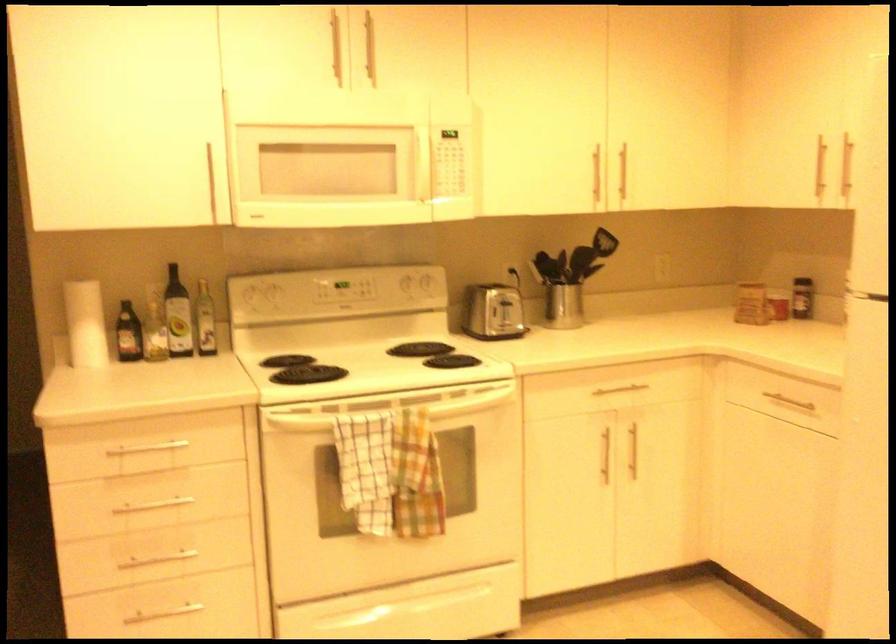
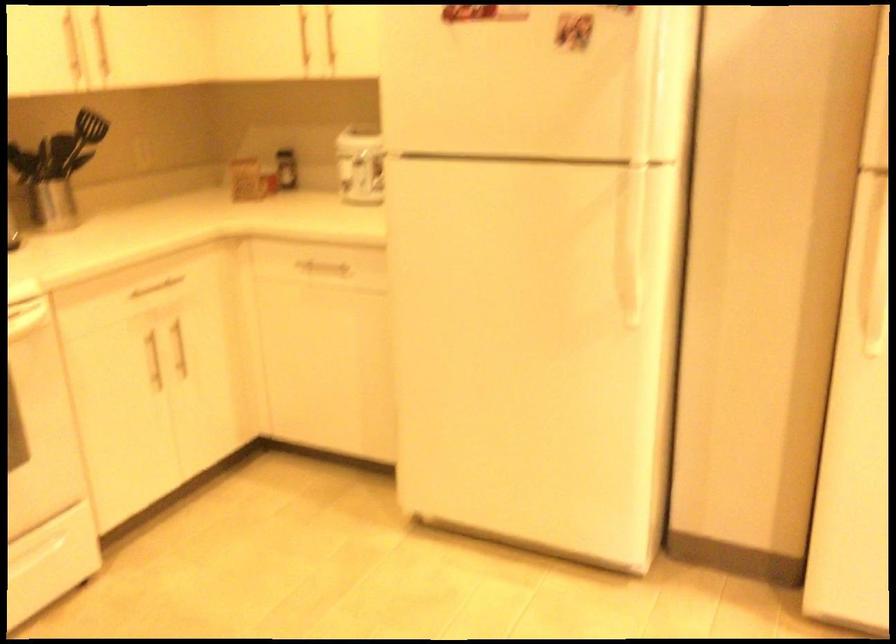
The point at [581,272] is marked in the first image. Where is the corresponding point in the second image?

(56, 169)